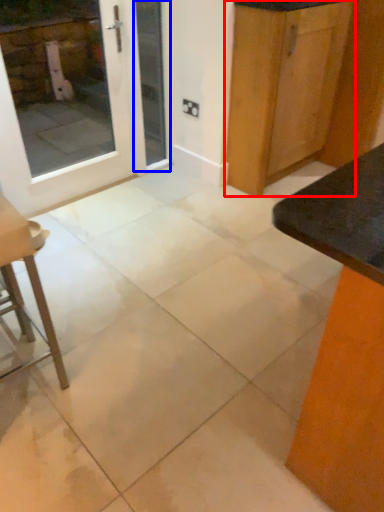
Question: Which of the following is the closest to the observer, cabinetry (highlighted by a red box) or screen door (highlighted by a blue box)?

Choices:
 (A) cabinetry
 (B) screen door

Answer: (A)